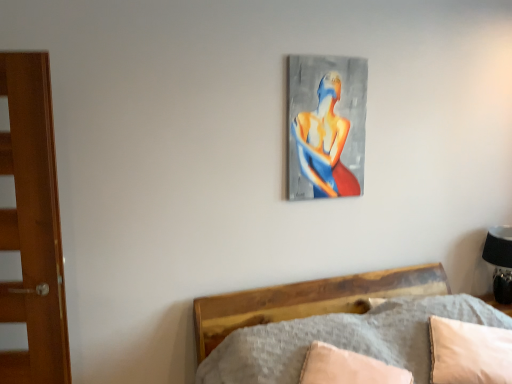
Identify the location of black matte table lamp at right. Image resolution: width=512 pixels, height=384 pixels. (500, 261).

I want to click on pillow that appears on the left of beige fabric pillow at lower right, which is counted as the second pillow, starting from the left, so click(x=347, y=368).

Is beige fabric pillow at lower right, arranged as the first pillow when viewed from the left, placed right next to beige fabric pillow at lower right, which appears as the 1th pillow when viewed from the right?

beige fabric pillow at lower right, arranged as the first pillow when viewed from the left, and beige fabric pillow at lower right, which appears as the 1th pillow when viewed from the right, are not in contact.

From the picture: Is beige fabric pillow at lower right, arranged as the second pillow when viewed from the right, aimed at beige fabric pillow at lower right, which is counted as the second pillow, starting from the left?

No.

Is abstract painting at upper center outside of beige fabric pillow at lower right, arranged as the second pillow when viewed from the right?

Yes, abstract painting at upper center is located beyond the bounds of beige fabric pillow at lower right, arranged as the second pillow when viewed from the right.

Considering the sizes of objects abstract painting at upper center and beige fabric pillow at lower right, arranged as the first pillow when viewed from the left, in the image provided, who is bigger, abstract painting at upper center or beige fabric pillow at lower right, arranged as the first pillow when viewed from the left,?

beige fabric pillow at lower right, arranged as the first pillow when viewed from the left.

Image resolution: width=512 pixels, height=384 pixels. What are the coordinates of `the 2nd pillow in front of the abstract painting at upper center, counting from the anchor's position` in the screenshot? It's located at (347, 368).

Considering the points (327, 164) and (373, 378), which point is in front, point (327, 164) or point (373, 378)?

The point (373, 378) is in front.

Is beige fabric pillow at lower right, arranged as the second pillow when viewed from the right, closer to camera compared to abstract painting at upper center?

That is True.

Between beige fabric pillow at lower right, arranged as the second pillow when viewed from the right, and abstract painting at upper center, which one has larger size?

beige fabric pillow at lower right, arranged as the second pillow when viewed from the right, is bigger.

Consider the image. Which point is more forward, (384, 373) or (323, 174)?

The point (384, 373) is more forward.

Considering the sizes of objects beige fabric pillow at lower right, arranged as the first pillow when viewed from the left, and abstract painting at upper center in the image provided, who is thinner, beige fabric pillow at lower right, arranged as the first pillow when viewed from the left, or abstract painting at upper center?

With smaller width is abstract painting at upper center.

Identify the location of table lamp lying behind the beige fabric pillow at lower right, which appears as the 1th pillow when viewed from the right. (500, 261).

Is beige fabric pillow at lower right, which appears as the 1th pillow when viewed from the right, positioned with its back to black matte table lamp at right?

That's right, beige fabric pillow at lower right, which appears as the 1th pillow when viewed from the right, is facing away from black matte table lamp at right.

Is beige fabric pillow at lower right, which appears as the 1th pillow when viewed from the right, not inside black matte table lamp at right?

Yes, beige fabric pillow at lower right, which appears as the 1th pillow when viewed from the right, is outside of black matte table lamp at right.

From the image's perspective, is black matte table lamp at right located beneath beige fabric pillow at lower right, arranged as the second pillow when viewed from the right?

No, from the image's perspective, black matte table lamp at right is not beneath beige fabric pillow at lower right, arranged as the second pillow when viewed from the right.

Would you consider black matte table lamp at right to be distant from beige fabric pillow at lower right, arranged as the second pillow when viewed from the right?

Yes, black matte table lamp at right and beige fabric pillow at lower right, arranged as the second pillow when viewed from the right, are quite far apart.

Which of these two, black matte table lamp at right or beige fabric pillow at lower right, arranged as the second pillow when viewed from the right, stands shorter?

Standing shorter between the two is beige fabric pillow at lower right, arranged as the second pillow when viewed from the right.

What are the coordinates of `pillow that appears on the right of abstract painting at upper center` in the screenshot? It's located at (469, 352).

Considering the relative sizes of beige fabric pillow at lower right, which appears as the 1th pillow when viewed from the right, and abstract painting at upper center in the image provided, is beige fabric pillow at lower right, which appears as the 1th pillow when viewed from the right, wider than abstract painting at upper center?

Yes, beige fabric pillow at lower right, which appears as the 1th pillow when viewed from the right, is wider than abstract painting at upper center.

Is beige fabric pillow at lower right, which appears as the 1th pillow when viewed from the right, taller or shorter than abstract painting at upper center?

Considering their sizes, beige fabric pillow at lower right, which appears as the 1th pillow when viewed from the right, has less height than abstract painting at upper center.

Does beige fabric pillow at lower right, which is counted as the second pillow, starting from the left, contain abstract painting at upper center?

No, abstract painting at upper center is not inside beige fabric pillow at lower right, which is counted as the second pillow, starting from the left.

How different are the orientations of beige fabric pillow at lower right, which is counted as the second pillow, starting from the left, and beige fabric pillow at lower right, arranged as the first pillow when viewed from the left, in degrees?

There is a 0.1-degree angle between the facing directions of beige fabric pillow at lower right, which is counted as the second pillow, starting from the left, and beige fabric pillow at lower right, arranged as the first pillow when viewed from the left.

From a real-world perspective, which is physically above, beige fabric pillow at lower right, which appears as the 1th pillow when viewed from the right, or beige fabric pillow at lower right, arranged as the first pillow when viewed from the left?

From a 3D spatial view, beige fabric pillow at lower right, which appears as the 1th pillow when viewed from the right, is above.

Which of these two, beige fabric pillow at lower right, which appears as the 1th pillow when viewed from the right, or beige fabric pillow at lower right, arranged as the first pillow when viewed from the left, is thinner?

With smaller width is beige fabric pillow at lower right, arranged as the first pillow when viewed from the left.

Between beige fabric pillow at lower right, which appears as the 1th pillow when viewed from the right, and beige fabric pillow at lower right, arranged as the second pillow when viewed from the right, which one appears on the right side from the viewer's perspective?

From the viewer's perspective, beige fabric pillow at lower right, which appears as the 1th pillow when viewed from the right, appears more on the right side.

At what (x,y) coordinates should I click in order to perform the action: click on pillow below the beige fabric pillow at lower right, which appears as the 1th pillow when viewed from the right (from the image's perspective). Please return your answer as a coordinate pair (x, y). Looking at the image, I should click on (347, 368).

The image size is (512, 384). I want to click on the 2nd pillow in front of the abstract painting at upper center, so click(347, 368).

From the picture: Looking at the image, which one is located further to beige fabric pillow at lower right, which is counted as the second pillow, starting from the left, black matte table lamp at right or abstract painting at upper center?

abstract painting at upper center is further to beige fabric pillow at lower right, which is counted as the second pillow, starting from the left.

Considering their positions, is beige fabric pillow at lower right, which appears as the 1th pillow when viewed from the right, positioned closer to abstract painting at upper center than beige fabric pillow at lower right, arranged as the second pillow when viewed from the right?

beige fabric pillow at lower right, which appears as the 1th pillow when viewed from the right, lies closer to abstract painting at upper center than the other object.

Based on the photo, from the image, which object appears to be nearer to beige fabric pillow at lower right, arranged as the second pillow when viewed from the right, black matte table lamp at right or abstract painting at upper center?

abstract painting at upper center.

When comparing their distances from beige fabric pillow at lower right, which is counted as the second pillow, starting from the left, does abstract painting at upper center or black matte table lamp at right seem closer?

Based on the image, black matte table lamp at right appears to be nearer to beige fabric pillow at lower right, which is counted as the second pillow, starting from the left.

When comparing their distances from abstract painting at upper center, does black matte table lamp at right or beige fabric pillow at lower right, arranged as the first pillow when viewed from the left, seem closer?

The object closer to abstract painting at upper center is beige fabric pillow at lower right, arranged as the first pillow when viewed from the left.

When comparing their distances from black matte table lamp at right, does beige fabric pillow at lower right, arranged as the first pillow when viewed from the left, or abstract painting at upper center seem closer?

The object closer to black matte table lamp at right is abstract painting at upper center.

Estimate the real-world distances between objects in this image. Which object is closer to beige fabric pillow at lower right, which is counted as the second pillow, starting from the left, beige fabric pillow at lower right, arranged as the second pillow when viewed from the right, or abstract painting at upper center?

Among the two, beige fabric pillow at lower right, arranged as the second pillow when viewed from the right, is located nearer to beige fabric pillow at lower right, which is counted as the second pillow, starting from the left.

Looking at the image, which one is located further to black matte table lamp at right, beige fabric pillow at lower right, which is counted as the second pillow, starting from the left, or beige fabric pillow at lower right, arranged as the first pillow when viewed from the left?

Based on the image, beige fabric pillow at lower right, arranged as the first pillow when viewed from the left, appears to be further to black matte table lamp at right.

Image resolution: width=512 pixels, height=384 pixels. I want to click on pillow between beige fabric pillow at lower right, arranged as the first pillow when viewed from the left, and black matte table lamp at right, along the z-axis, so click(x=469, y=352).

Where is `person located between beige fabric pillow at lower right, arranged as the first pillow when viewed from the left, and black matte table lamp at right in the left-right direction`? person located between beige fabric pillow at lower right, arranged as the first pillow when viewed from the left, and black matte table lamp at right in the left-right direction is located at coordinates (325, 143).

Where is `pillow situated between abstract painting at upper center and black matte table lamp at right from left to right`? This screenshot has width=512, height=384. pillow situated between abstract painting at upper center and black matte table lamp at right from left to right is located at coordinates click(x=469, y=352).

Find the location of a particular element. The image size is (512, 384). pillow between abstract painting at upper center and beige fabric pillow at lower right, arranged as the second pillow when viewed from the right, in the vertical direction is located at coordinates (469, 352).